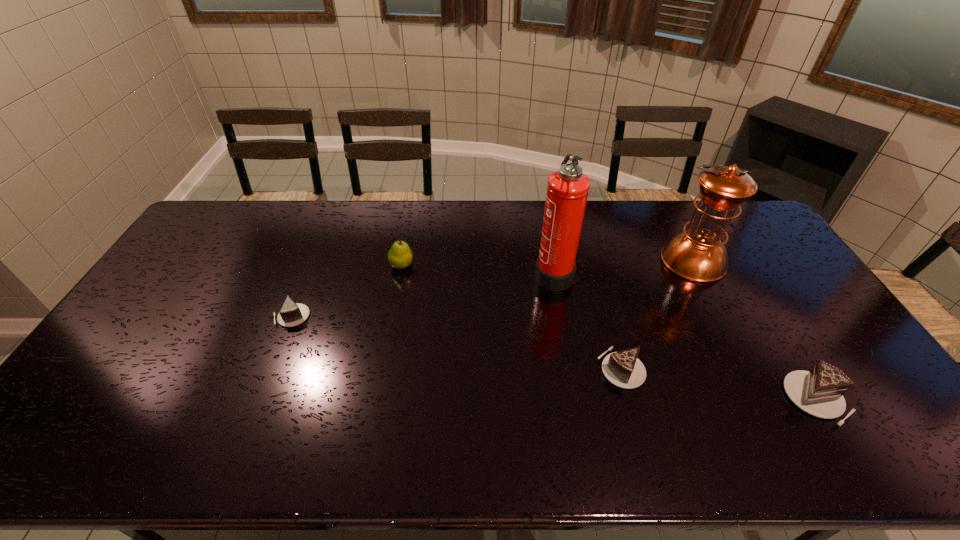
This screenshot has width=960, height=540. Identify the location of the fourth object from right to left. (567, 190).

The height and width of the screenshot is (540, 960). What are the coordinates of `vacant area located on the front of the farthest chocolate cake` in the screenshot? It's located at (x=265, y=382).

Identify the location of free space located 0.090m on the left of the second shortest object. (564, 368).

This screenshot has width=960, height=540. Identify the location of free location located 0.180m on the left of the fourth tallest object. (716, 399).

Identify the location of free spot located 0.200m on the back of the oil lamp. [665, 207].

The width and height of the screenshot is (960, 540). I want to click on vacant space situated 0.290m on the right of the fourth shortest object, so click(501, 265).

I want to click on vacant space located 0.110m on the front-facing side of the fourth object from right to left, so click(x=499, y=273).

The width and height of the screenshot is (960, 540). In order to click on free space located on the front-facing side of the fourth object from right to left in this screenshot , I will do `click(466, 273)`.

This screenshot has height=540, width=960. In order to click on vacant area situated 0.140m on the front-facing side of the fourth object from right to left in this screenshot , I will do `click(491, 273)`.

You are a GUI agent. You are given a task and a screenshot of the screen. Output one action in this format:
    pyautogui.click(x=<x>, y=<y>)
    Task: Click on the object located at the right edge
    The image size is (960, 540).
    Given the screenshot: What is the action you would take?
    pyautogui.click(x=819, y=392)